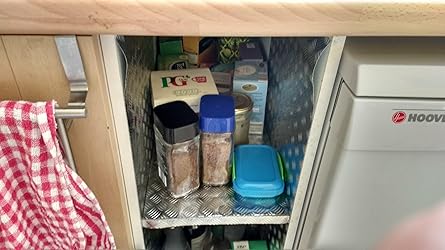
The image size is (445, 250). Find the location of `boxed items`. boxed items is located at coordinates (246, 74), (198, 82), (199, 52), (180, 61).